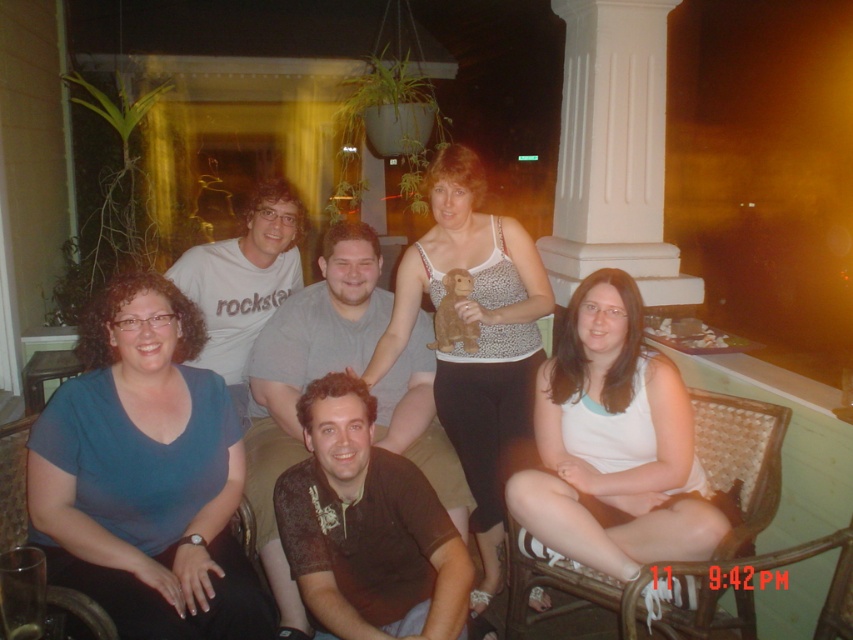
You are a photographer adjusting your camera settings to capture the scene. You notice the blue fabric shirt at lower left and the brown woven chair at lower left in your frame. Which object should you focus on first to ensure both are in sharp focus?

The blue fabric shirt at lower left is closer to the viewer than the brown woven chair at lower left, so focusing on the closer object first will help ensure both are in sharp focus.

Based on the photo, you are a photographer who needs to adjust the lighting for a group photo. You have a small spotlight that can cover an area of 18 inches in diameter. You want to ensure both the blue fabric shirt at lower left and the brown woven chair at lower left are fully illuminated. Can the spotlight cover both objects simultaneously?

The distance between the blue fabric shirt at lower left and the brown woven chair at lower left is 17.86 inches. Since the spotlight covers 18 inches in diameter, it can fully illuminate both objects at the same time.

You are standing in front of the porch and want to take a photo of both point (213,536) and point (65,616). Which point is closer to the camera?

Point (213,536) is further to the camera than point (65,616), so the point (65,616) is closer to the camera.